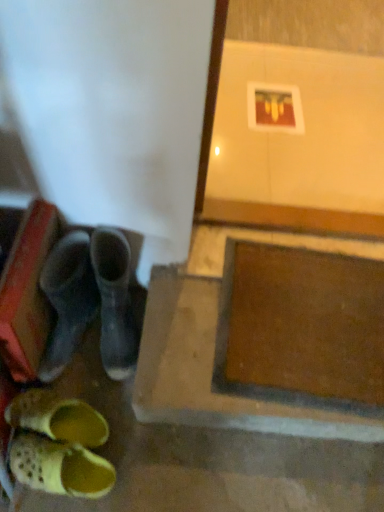
This screenshot has height=512, width=384. In order to click on vacant space that's between brown matte concrete at lower right and yellow mesh clog at lower left in this screenshot , I will do `click(182, 448)`.